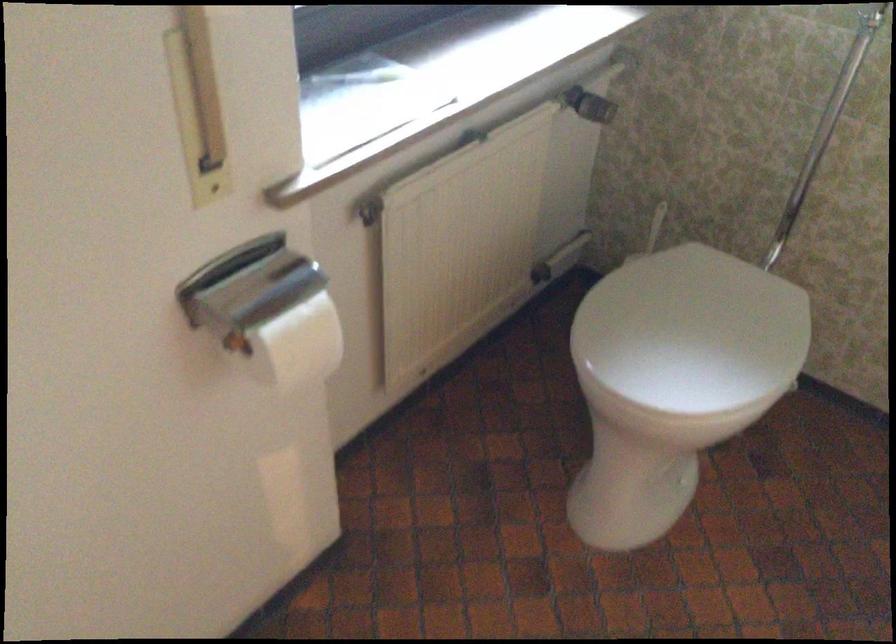
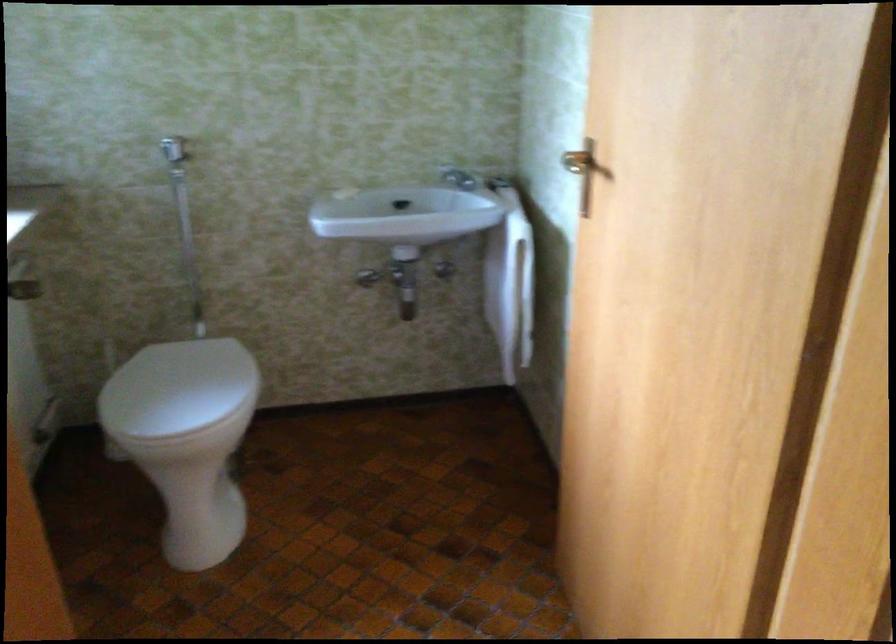
Where in the second image is the point corresponding to point 676,321 from the first image?

(177, 388)